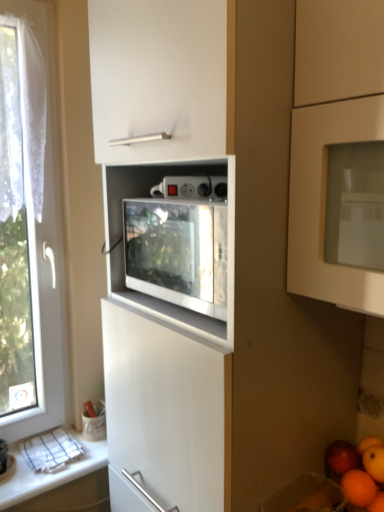
Question: From a real-world perspective, is orange matte at lower right, positioned as the second orange in bottom-to-top order, under orange matte at lower right, which is the first orange from bottom to top?

Choices:
 (A) no
 (B) yes

Answer: (A)

Question: Considering the relative sizes of orange matte at lower right, positioned as the second orange in bottom-to-top order, and orange matte at lower right, which is the first orange from bottom to top, in the image provided, is orange matte at lower right, positioned as the second orange in bottom-to-top order, thinner than orange matte at lower right, which is the first orange from bottom to top,?

Choices:
 (A) yes
 (B) no

Answer: (B)

Question: Is orange matte at lower right, arranged as the 1th orange when viewed from the top, positioned behind orange matte at lower right, the second orange in the top-to-bottom sequence?

Choices:
 (A) no
 (B) yes

Answer: (B)

Question: From the image's perspective, does orange matte at lower right, positioned as the second orange in bottom-to-top order, appear lower than orange matte at lower right, the second orange in the top-to-bottom sequence?

Choices:
 (A) yes
 (B) no

Answer: (B)

Question: Is orange matte at lower right, positioned as the second orange in bottom-to-top order, to the left of orange matte at lower right, which is the first orange from bottom to top, from the viewer's perspective?

Choices:
 (A) yes
 (B) no

Answer: (A)

Question: Relative to orange matte at lower right, arranged as the 1th orange when viewed from the top, is red matte apple at lower right in front or behind?

Choices:
 (A) behind
 (B) front

Answer: (A)

Question: From a real-world perspective, is red matte apple at lower right physically located above or below orange matte at lower right, arranged as the 1th orange when viewed from the top?

Choices:
 (A) above
 (B) below

Answer: (B)

Question: Is red matte apple at lower right bigger or smaller than orange matte at lower right, arranged as the 1th orange when viewed from the top?

Choices:
 (A) small
 (B) big

Answer: (A)

Question: Considering the positions of red matte apple at lower right and orange matte at lower right, positioned as the second orange in bottom-to-top order, in the image, is red matte apple at lower right wider or thinner than orange matte at lower right, positioned as the second orange in bottom-to-top order,?

Choices:
 (A) wide
 (B) thin

Answer: (B)

Question: From a real-world perspective, is transparent fabric at left physically located above or below smooth orange at lower right?

Choices:
 (A) above
 (B) below

Answer: (A)

Question: Looking at the image, does transparent fabric at left seem bigger or smaller compared to smooth orange at lower right?

Choices:
 (A) big
 (B) small

Answer: (A)

Question: Considering the positions of transparent fabric at left and smooth orange at lower right in the image, is transparent fabric at left wider or thinner than smooth orange at lower right?

Choices:
 (A) wide
 (B) thin

Answer: (A)

Question: Considering the positions of transparent fabric at left and smooth orange at lower right in the image, is transparent fabric at left taller or shorter than smooth orange at lower right?

Choices:
 (A) tall
 (B) short

Answer: (A)

Question: Visually, is red matte apple at lower right positioned to the left or to the right of transparent fabric at left?

Choices:
 (A) right
 (B) left

Answer: (A)

Question: Looking at their shapes, would you say red matte apple at lower right is wider or thinner than transparent fabric at left?

Choices:
 (A) wide
 (B) thin

Answer: (B)